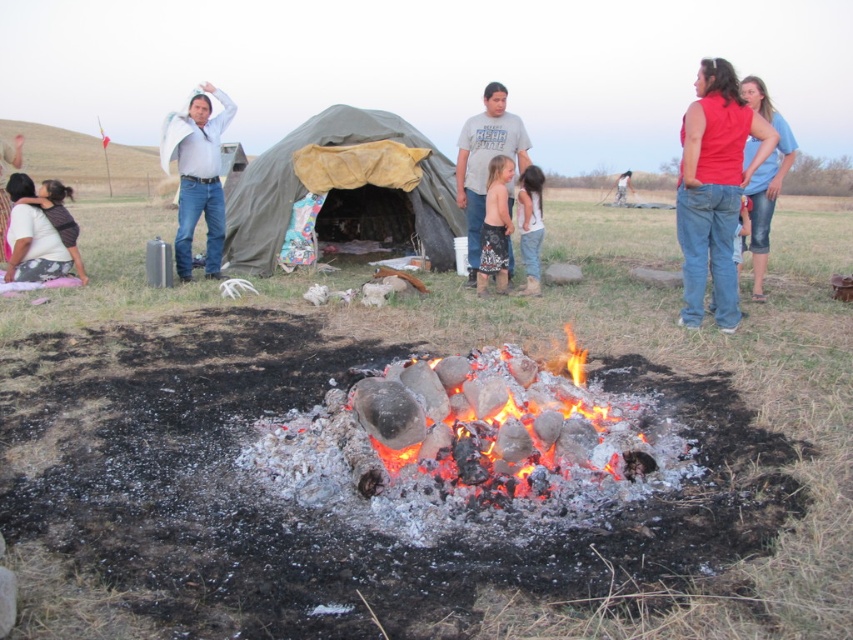
The image size is (853, 640). What are the coordinates of `light blue shirt at upper left` in the screenshot? It's located at (196, 176).

Measure the distance between light blue shirt at upper left and denim shorts at right.

light blue shirt at upper left and denim shorts at right are 19.96 feet apart from each other.

Between point (202, 161) and point (759, 262), which one is positioned in front?

Point (759, 262) is more forward.

Locate an element on the screen. The height and width of the screenshot is (640, 853). light blue shirt at upper left is located at coordinates (196, 176).

Can you confirm if red denim jeans at center is positioned to the right of light blue shirt at upper left?

Indeed, red denim jeans at center is positioned on the right side of light blue shirt at upper left.

Is red denim jeans at center closer to the viewer compared to light blue shirt at upper left?

That is True.

Between point (769, 150) and point (218, 192), which one is positioned in front?

Point (769, 150) is in front.

Find the location of a particular element. Image resolution: width=853 pixels, height=640 pixels. red denim jeans at center is located at coordinates (714, 188).

Is charcoal logs at center closer to camera compared to denim shorts at right?

Yes, charcoal logs at center is in front of denim shorts at right.

Is charcoal logs at center to the left of denim shorts at right from the viewer's perspective?

Indeed, charcoal logs at center is positioned on the left side of denim shorts at right.

Where is `charcoal logs at center`? charcoal logs at center is located at coordinates (490, 420).

Locate an element on the screen. This screenshot has width=853, height=640. charcoal logs at center is located at coordinates [490, 420].